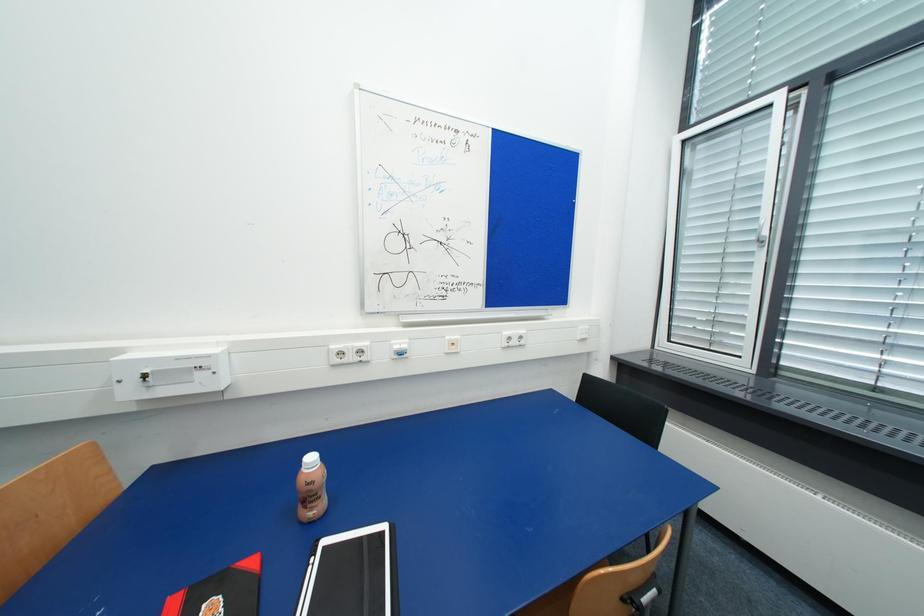
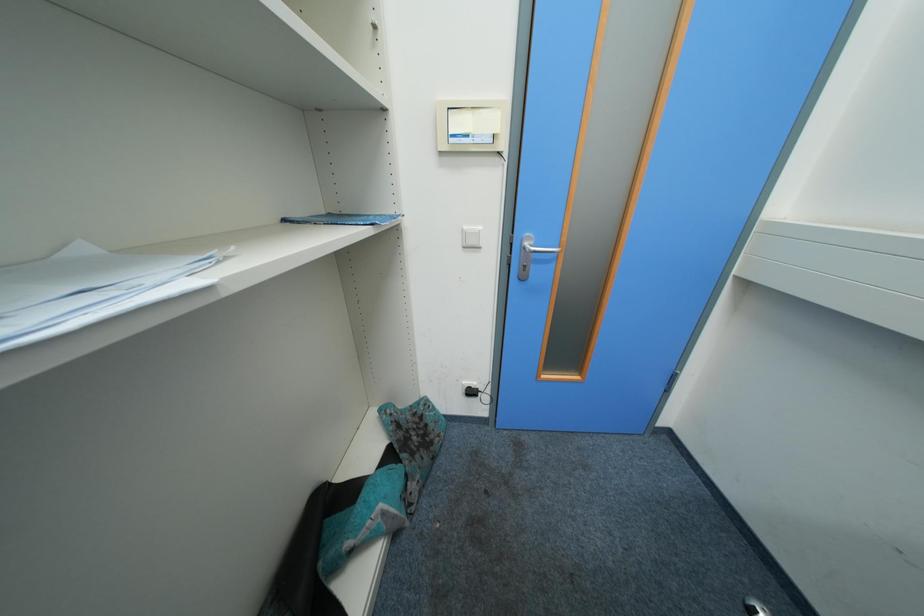
First-person continuous shooting, in which direction is the camera rotating?

The camera's rotation is toward left-down.